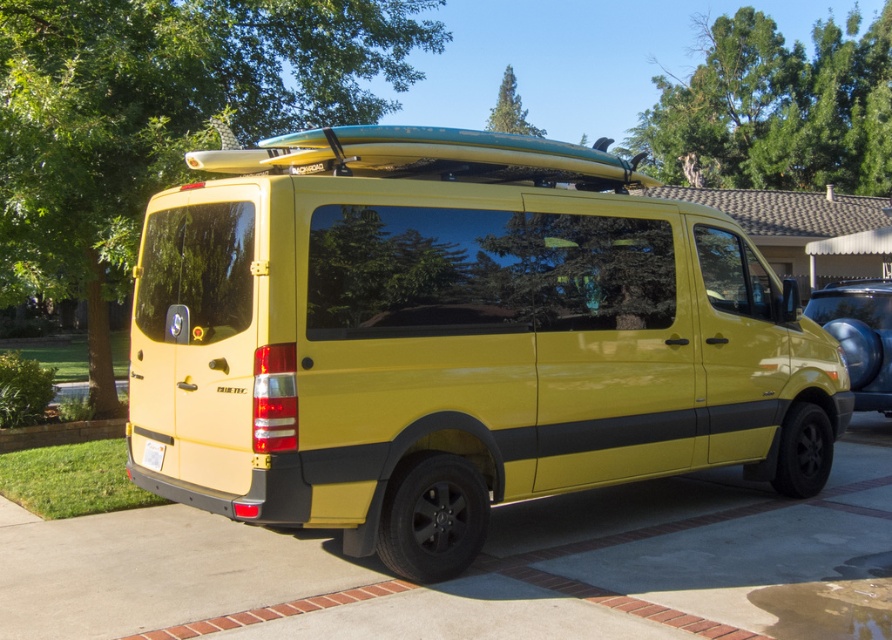
Can you confirm if metallic blue surfboard at right is positioned to the left of white plastic license plate at lower center?

In fact, metallic blue surfboard at right is to the right of white plastic license plate at lower center.

Which is in front, point (859, 394) or point (149, 460)?

Positioned in front is point (149, 460).

The width and height of the screenshot is (892, 640). I want to click on metallic blue surfboard at right, so click(x=859, y=333).

Is point (771, 387) less distant than point (877, 385)?

That is True.

Is glossy yellow van at center thinner than metallic blue surfboard at right?

Correct, glossy yellow van at center's width is less than metallic blue surfboard at right's.

Who is more distant from viewer, (x=398, y=413) or (x=857, y=408)?

Point (x=857, y=408)

Image resolution: width=892 pixels, height=640 pixels. In order to click on glossy yellow van at center in this screenshot , I will do `click(456, 339)`.

Is glossy yellow van at center taller than white plastic license plate at lower center?

Yes, glossy yellow van at center is taller than white plastic license plate at lower center.

Is point (209, 316) farther from viewer compared to point (159, 467)?

No, it is in front of (159, 467).

The width and height of the screenshot is (892, 640). I want to click on glossy yellow van at center, so click(x=456, y=339).